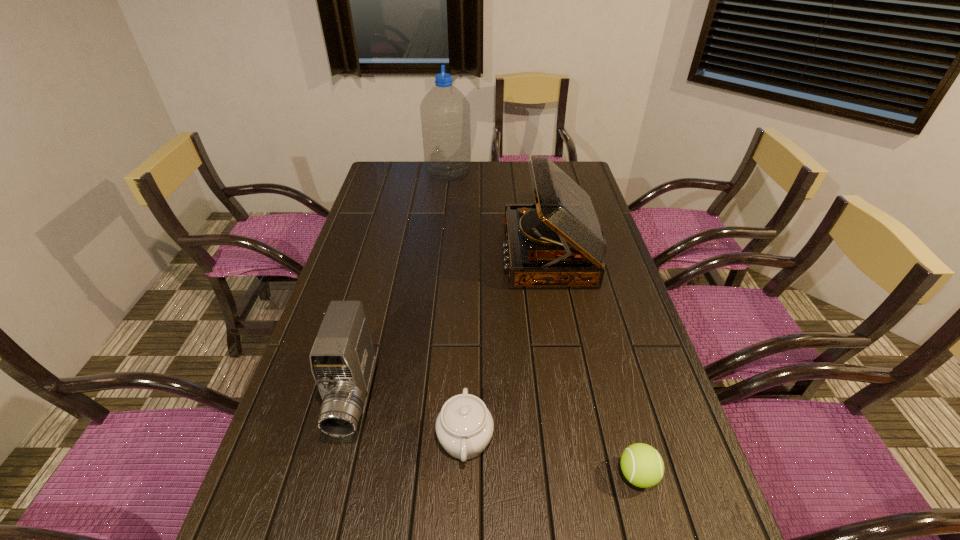
The height and width of the screenshot is (540, 960). In order to click on vacant space at the left edge of the desktop in this screenshot , I will do `click(371, 274)`.

This screenshot has width=960, height=540. Find the location of `free region at the right edge of the desktop`. free region at the right edge of the desktop is located at coordinates (651, 446).

The image size is (960, 540). In order to click on vacant region between the shortest object and the third shortest object in this screenshot , I will do `click(495, 436)`.

Where is `vacant space in between the tallest object and the tennis ball`? This screenshot has width=960, height=540. vacant space in between the tallest object and the tennis ball is located at coordinates [542, 324].

This screenshot has width=960, height=540. Find the location of `unoccupied position between the fourth nearest object and the tennis ball`. unoccupied position between the fourth nearest object and the tennis ball is located at coordinates (593, 364).

You are a GUI agent. You are given a task and a screenshot of the screen. Output one action in this format:
    pyautogui.click(x=<x>, y=<y>)
    Task: Click on the free spot between the fourth nearest object and the camcorder
    Image resolution: width=960 pixels, height=540 pixels.
    Given the screenshot: What is the action you would take?
    pyautogui.click(x=451, y=326)

Identify the location of empty space that is in between the shortest object and the camcorder. (495, 436).

Find the location of a particular element. This screenshot has width=960, height=540. unoccupied area between the camcorder and the farthest object is located at coordinates (401, 285).

I want to click on vacant area between the tennis ball and the record player, so click(x=593, y=364).

The width and height of the screenshot is (960, 540). Find the location of `free spot between the record player and the water jug`. free spot between the record player and the water jug is located at coordinates (498, 213).